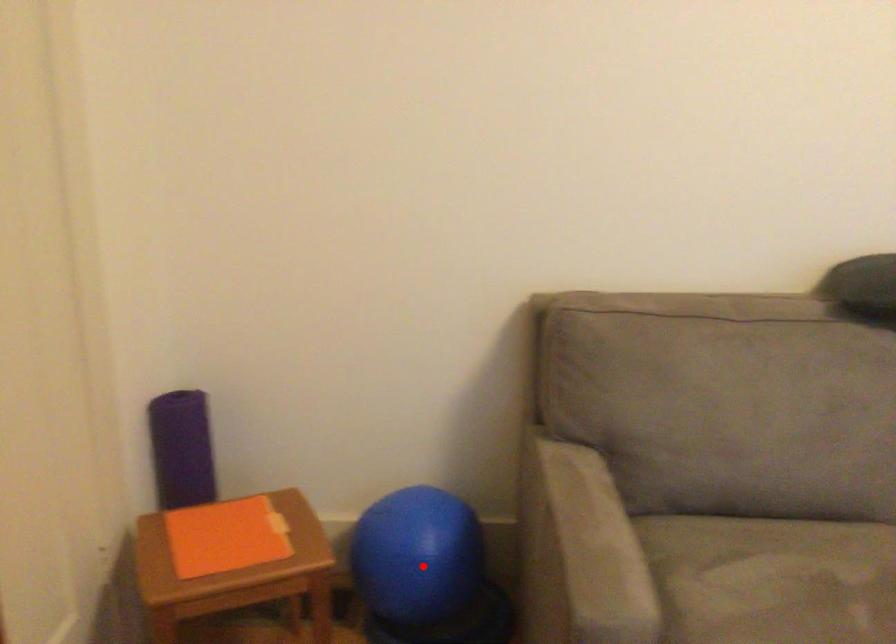
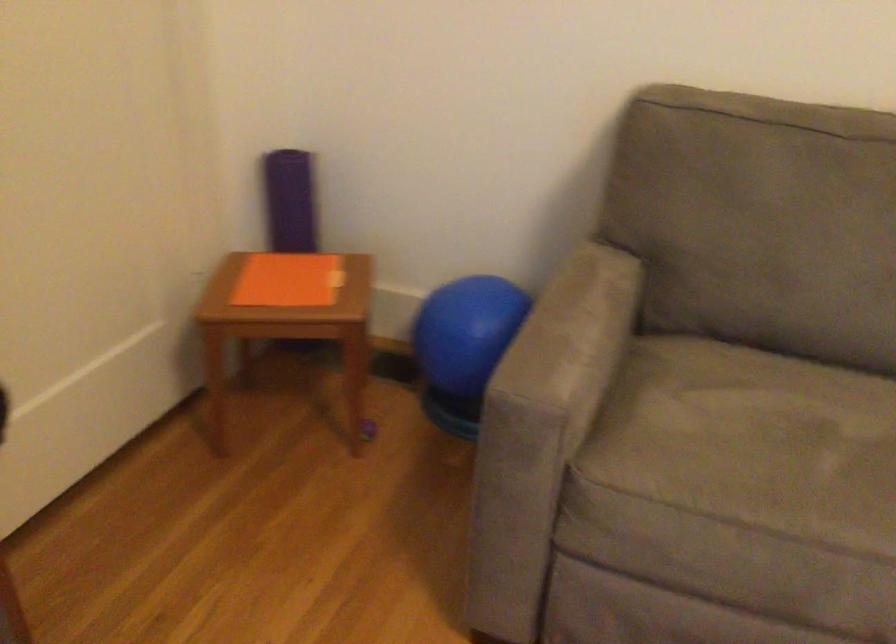
The point at the highlighted location is marked in the first image. Where is the corresponding point in the second image?

(463, 345)